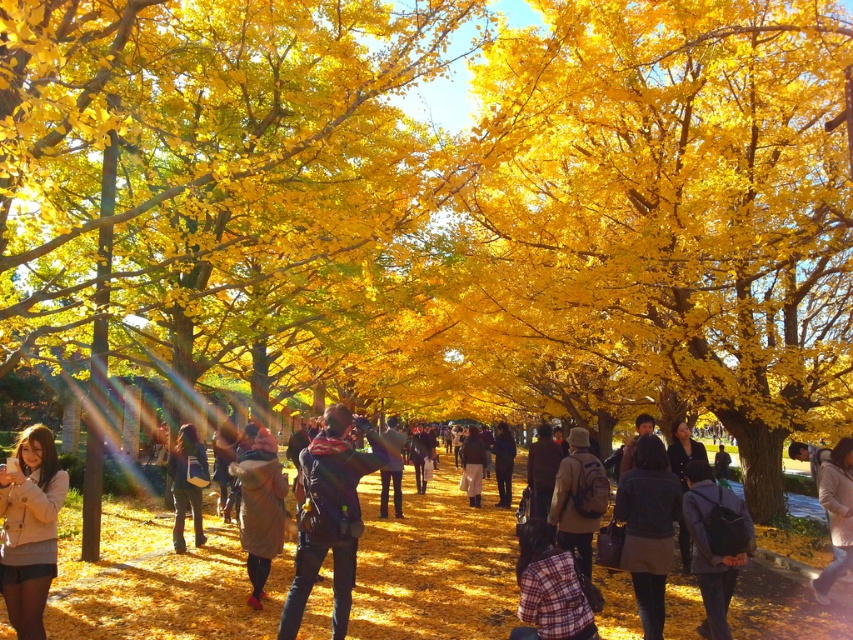
Question: From the image, what is the correct spatial relationship of dark blue jeans at center in relation to velvet brown coat at center?

Choices:
 (A) left
 (B) right

Answer: (B)

Question: Estimate the real-world distances between objects in this image. Which object is closer to the dark blue jeans at center?

Choices:
 (A) matte beige coat at lower left
 (B) velvet brown coat at center

Answer: (B)

Question: Is velvet brown coat at center thinner than matte black jacket at center?

Choices:
 (A) no
 (B) yes

Answer: (B)

Question: Which object is the closest to the golden leafy tree at center?

Choices:
 (A) matte black jacket at center
 (B) velvet brown coat at center

Answer: (B)

Question: Is matte beige coat at lower left positioned at the back of velvet brown coat at center?

Choices:
 (A) yes
 (B) no

Answer: (B)

Question: Which of the following is the farthest from the observer?

Choices:
 (A) dark blue jeans at center
 (B) golden leafy tree at center
 (C) velvet brown coat at center

Answer: (B)